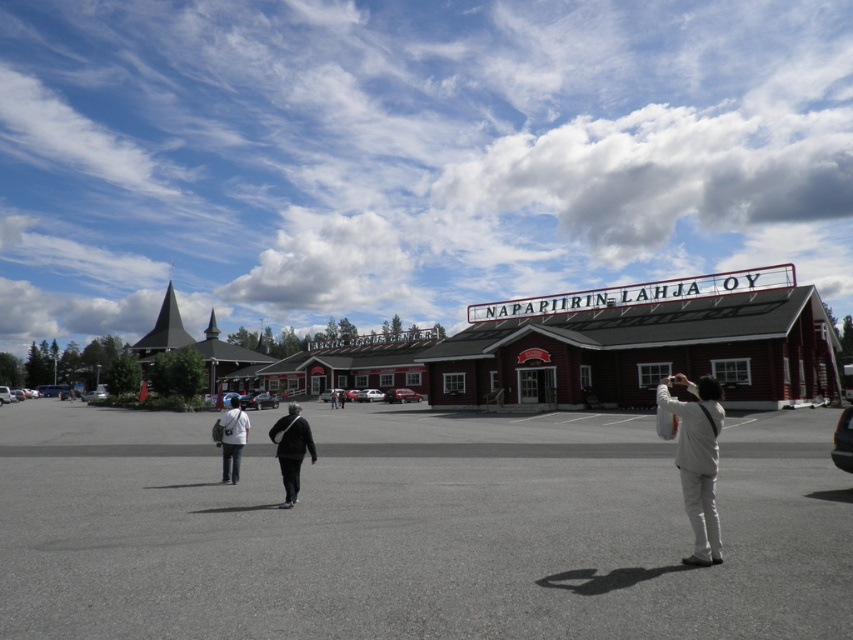
Does dark gray fabric couple at center lie behind dark gray suit at center?

Yes, dark gray fabric couple at center is behind dark gray suit at center.

The height and width of the screenshot is (640, 853). What do you see at coordinates (291, 449) in the screenshot?
I see `dark gray fabric couple at center` at bounding box center [291, 449].

Image resolution: width=853 pixels, height=640 pixels. What do you see at coordinates (291, 449) in the screenshot?
I see `dark gray fabric couple at center` at bounding box center [291, 449].

Locate an element on the screen. The width and height of the screenshot is (853, 640). dark gray fabric couple at center is located at coordinates (291, 449).

Can you confirm if white fabric camera at center is positioned to the right of dark gray fabric couple at center?

Yes, white fabric camera at center is to the right of dark gray fabric couple at center.

Which of these two, white fabric camera at center or dark gray fabric couple at center, stands shorter?

white fabric camera at center is shorter.

Is point (683, 416) farther from viewer compared to point (299, 470)?

No.

At what (x,y) coordinates should I click in order to perform the action: click on white fabric camera at center. Please return your answer as a coordinate pair (x, y). The height and width of the screenshot is (640, 853). Looking at the image, I should click on (697, 460).

Is dark gray suit at center further to the viewer compared to light beige fabric bag at center?

No.

Describe the element at coordinates (291, 449) in the screenshot. I see `dark gray suit at center` at that location.

Is point (299, 484) farther from camera compared to point (225, 480)?

No, (299, 484) is in front of (225, 480).

You are a GUI agent. You are given a task and a screenshot of the screen. Output one action in this format:
    pyautogui.click(x=<x>, y=<y>)
    Task: Click on the dark gray suit at center
    The height and width of the screenshot is (640, 853).
    Given the screenshot: What is the action you would take?
    pyautogui.click(x=291, y=449)